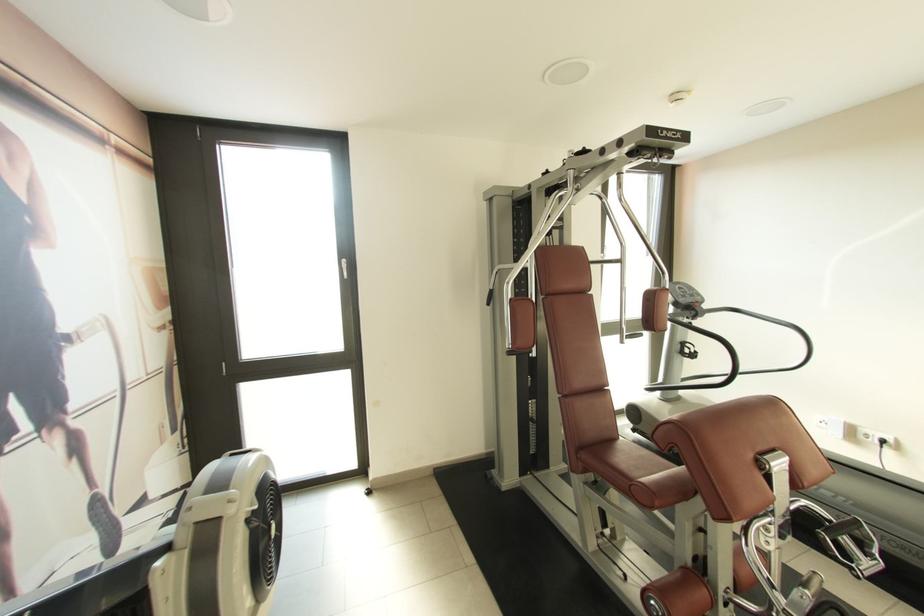
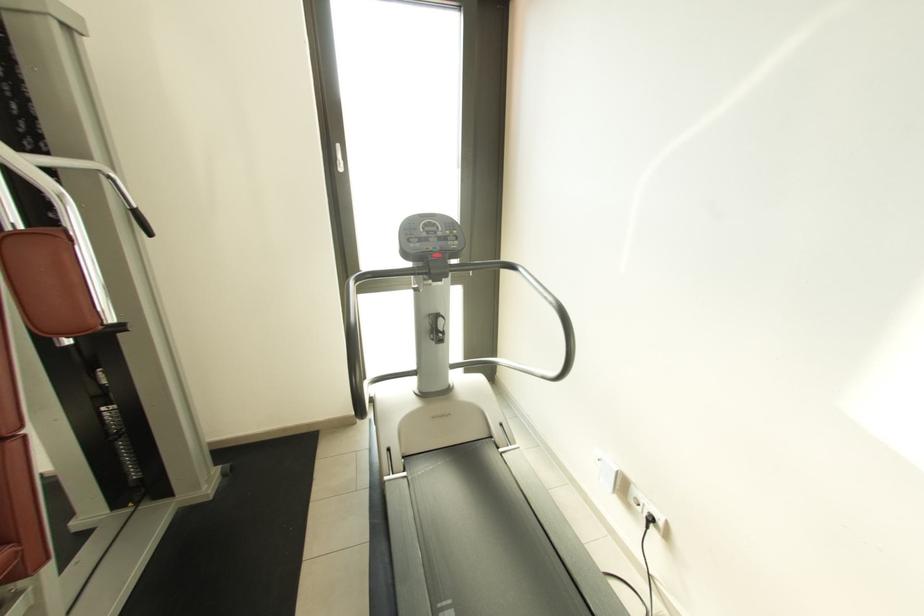
The point at (688,292) is marked in the first image. Where is the corresponding point in the second image?

(439, 230)